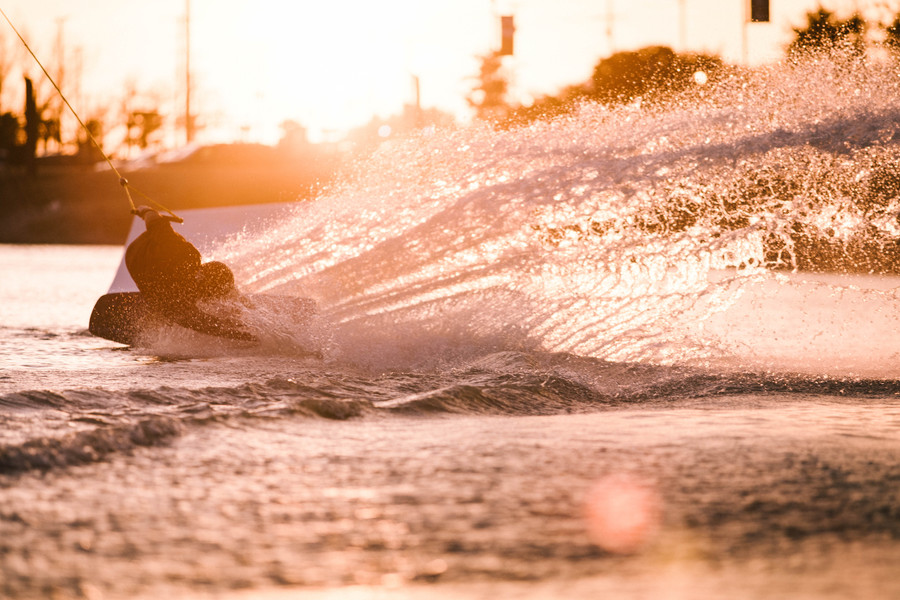
I want to click on light source, so click(x=330, y=109).